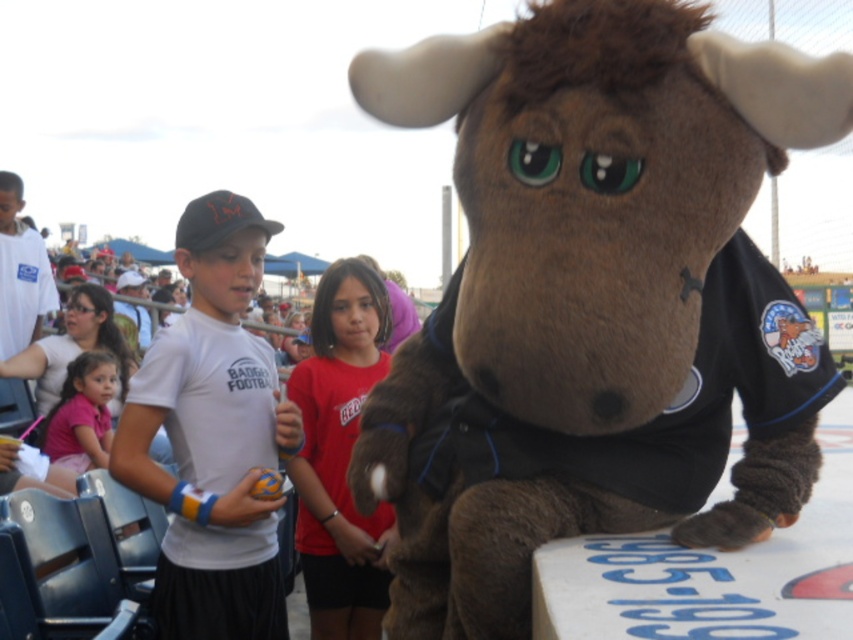
Question: Which object is the closest to the pink fabric shirt at lower left?

Choices:
 (A) matte red shirt at center
 (B) brown plush moose at center

Answer: (A)

Question: Is matte red shirt at center wider than pink fabric shirt at lower left?

Choices:
 (A) yes
 (B) no

Answer: (B)

Question: Observing the image, what is the correct spatial positioning of brown plush moose at center in reference to pink fabric shirt at lower left?

Choices:
 (A) right
 (B) left

Answer: (A)

Question: Which point is farther to the camera?

Choices:
 (A) (389, 541)
 (B) (103, 394)
 (C) (630, 310)

Answer: (B)

Question: Which object is positioned closest to the pink fabric shirt at lower left?

Choices:
 (A) matte red shirt at center
 (B) brown plush moose at center

Answer: (A)

Question: Does matte red shirt at center have a larger size compared to pink fabric shirt at lower left?

Choices:
 (A) no
 (B) yes

Answer: (B)